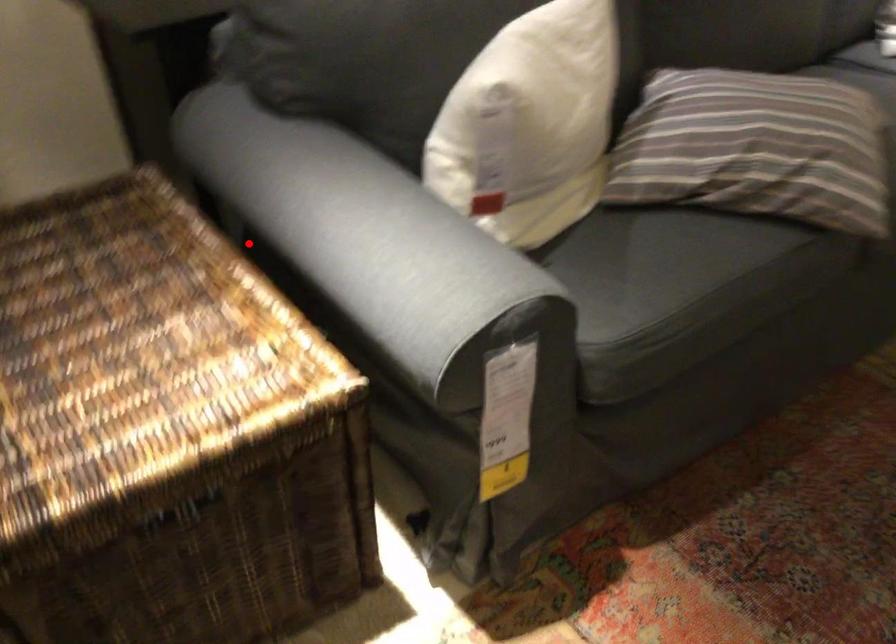
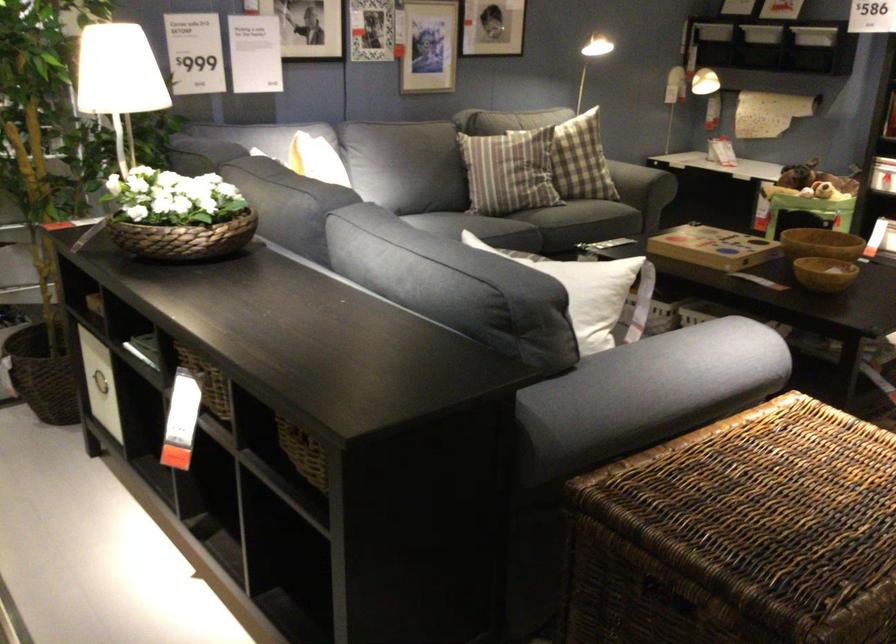
Question: I am providing you with two images of the same scene from different viewpoints. A red point is marked on the first image. Is the red point's position out of view in image 2?

Choices:
 (A) Yes
 (B) No

Answer: (B)